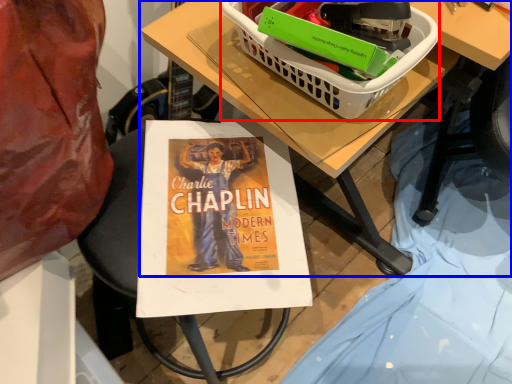
Question: Which of the following is the farthest to the observer, basket (highlighted by a red box) or table (highlighted by a blue box)?

Choices:
 (A) basket
 (B) table

Answer: (B)